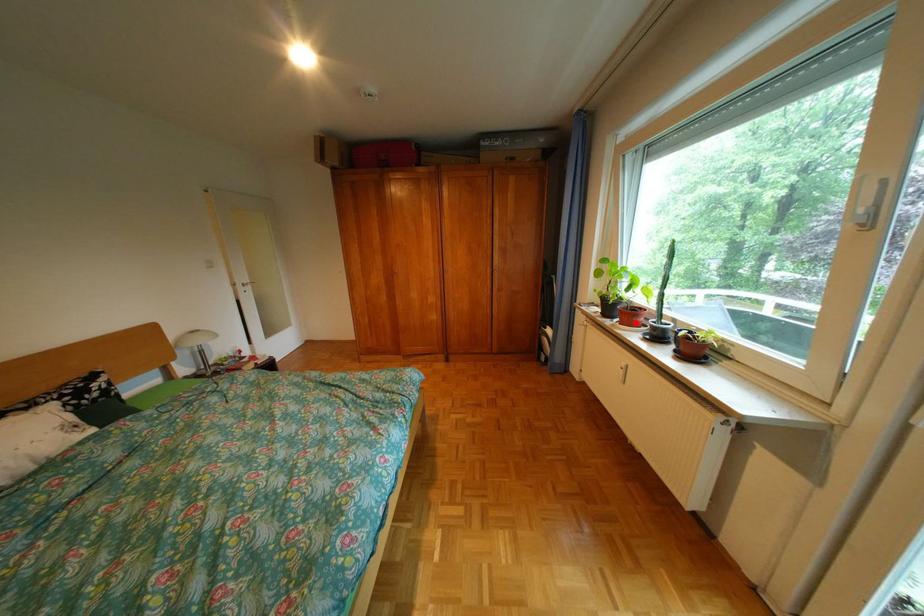
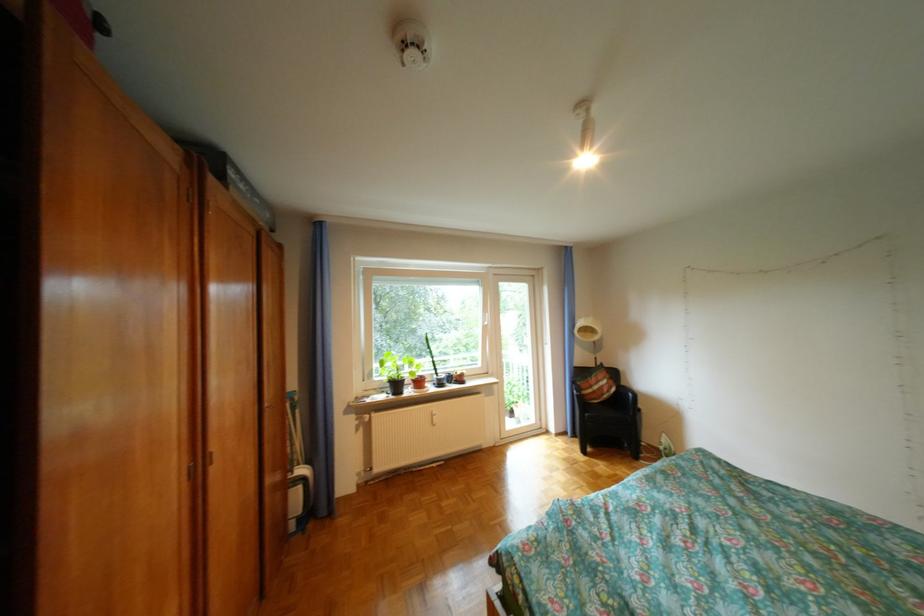
Question: I am providing you with two images of the same scene from different viewpoints. A red point is marked on the first image. Is the red point's position out of view in image 2?

Choices:
 (A) Yes
 (B) No

Answer: (A)